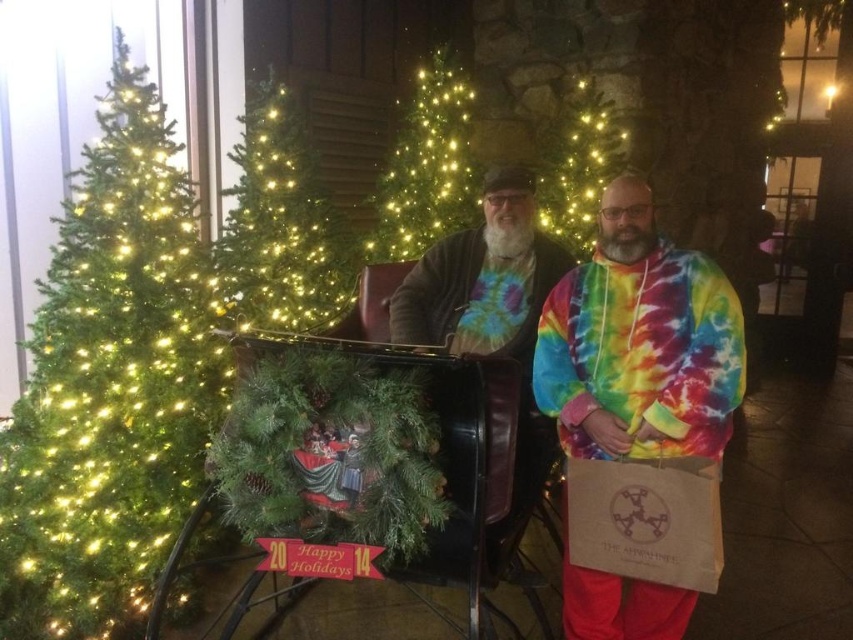
Question: Does green artificial christmas tree at left come behind metallic black wagon at center?

Choices:
 (A) yes
 (B) no

Answer: (A)

Question: Which point is closer to the camera?

Choices:
 (A) tie-dye hoodie at center
 (B) brown paper bag at lower right
 (C) green matte christmas tree at center
 (D) green artificial christmas tree at left

Answer: (B)

Question: Which object is the farthest from the metallic black wagon at center?

Choices:
 (A) illuminated green christmas tree at center
 (B) brown paper bag at lower right
 (C) green artificial christmas tree at left
 (D) green matte christmas tree at center

Answer: (A)

Question: Based on their relative distances, which object is nearer to the green matte christmas tree at upper left?

Choices:
 (A) illuminated green christmas tree at center
 (B) metallic black wagon at center
 (C) tie-dye hoodie at center
 (D) green artificial christmas tree at left

Answer: (A)

Question: Can you confirm if green matte christmas tree at upper left is wider than brown paper bag at lower right?

Choices:
 (A) no
 (B) yes

Answer: (B)

Question: Can you confirm if green artificial christmas tree at left is positioned to the left of green matte christmas tree at center?

Choices:
 (A) yes
 (B) no

Answer: (A)